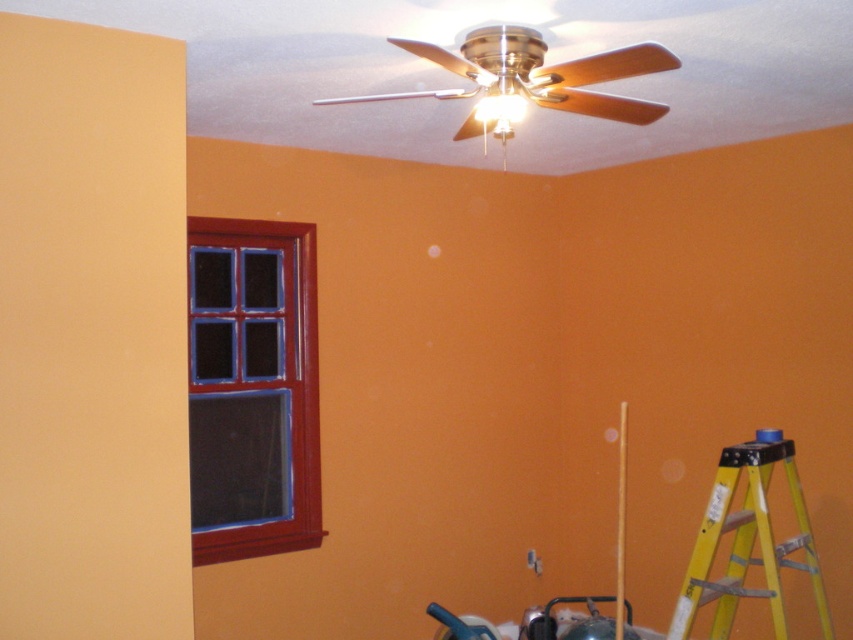
Between matte red wooden window at left and yellow/yellowish metal ladder at lower right, which one is positioned higher?

Positioned higher is matte red wooden window at left.

Looking at this image, which is below, matte red wooden window at left or yellow/yellowish metal ladder at lower right?

Positioned lower is yellow/yellowish metal ladder at lower right.

Where is `matte red wooden window at left`? This screenshot has width=853, height=640. matte red wooden window at left is located at coordinates (252, 388).

Locate an element on the screen. This screenshot has width=853, height=640. matte red wooden window at left is located at coordinates point(252,388).

Does point (509, 100) come closer to viewer compared to point (770, 557)?

Yes, it is.

Image resolution: width=853 pixels, height=640 pixels. What are the coordinates of `brushed metal fan at upper center` in the screenshot? It's located at (531, 81).

The height and width of the screenshot is (640, 853). In order to click on brushed metal fan at upper center in this screenshot , I will do `click(531, 81)`.

Between matte red wooden window at left and brushed metal fan at upper center, which one has more height?

With more height is matte red wooden window at left.

Does matte red wooden window at left appear over brushed metal fan at upper center?

Incorrect, matte red wooden window at left is not positioned above brushed metal fan at upper center.

The image size is (853, 640). Identify the location of matte red wooden window at left. (252, 388).